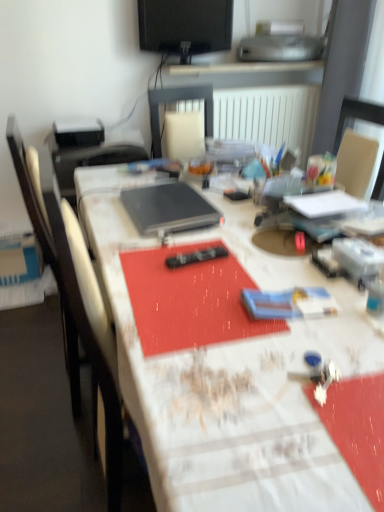
Question: From a real-world perspective, is black plastic remote control at center positioned above or below black glossy monitor at upper center?

Choices:
 (A) below
 (B) above

Answer: (A)

Question: In the image, is black plastic remote control at center on the left side or the right side of black glossy monitor at upper center?

Choices:
 (A) right
 (B) left

Answer: (A)

Question: Estimate the real-world distances between objects in this image. Which object is farther from the black matte laptop at center?

Choices:
 (A) black plastic remote control at center
 (B) white textured table at center
 (C) silver metallic printer at upper center
 (D) black glossy monitor at upper center

Answer: (C)

Question: Considering the real-world distances, which object is closest to the black glossy monitor at upper center?

Choices:
 (A) black matte laptop at center
 (B) black plastic remote control at center
 (C) silver metallic printer at upper center
 (D) white textured table at center

Answer: (C)